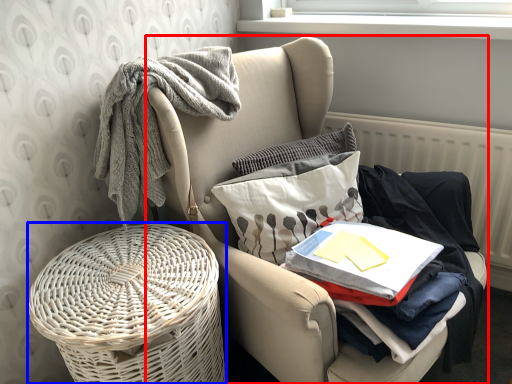
Question: Which object appears farthest to the camera in this image, chair (highlighted by a red box) or basket container (highlighted by a blue box)?

Choices:
 (A) chair
 (B) basket container

Answer: (B)